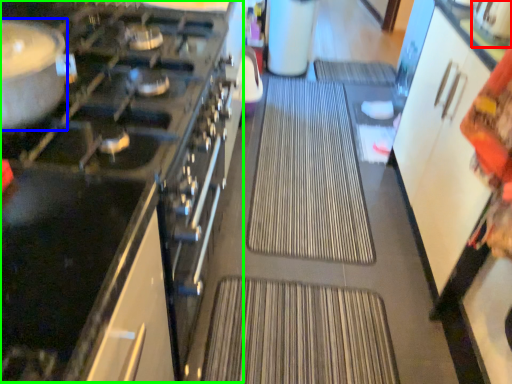
Question: Based on their relative distances, which object is farther from appliance (highlighted by a red box)? Choose from kitchen appliance (highlighted by a blue box) and appliance (highlighted by a green box).

Choices:
 (A) kitchen appliance
 (B) appliance

Answer: (A)